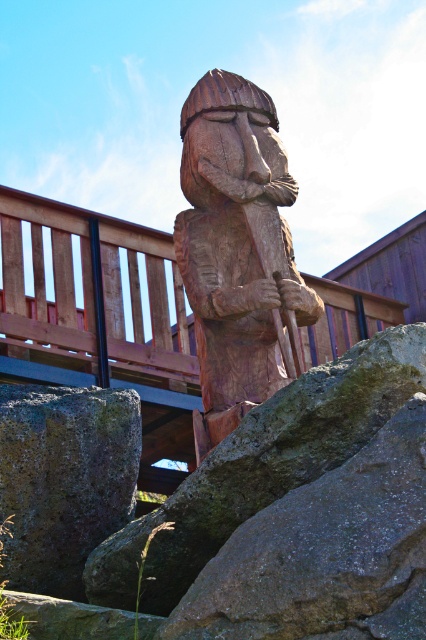
Question: Which point is farther from the camera taking this photo?

Choices:
 (A) (307, 385)
 (B) (14, 502)
 (C) (215, 208)

Answer: (C)

Question: Among these objects, which one is nearest to the camera?

Choices:
 (A) rough textured rock at center
 (B) gray rough stone at lower left

Answer: (A)

Question: Does rough textured rock at center appear under gray rough stone at lower left?

Choices:
 (A) yes
 (B) no

Answer: (B)

Question: Is the position of rough textured rock at center more distant than that of gray rough stone at lower left?

Choices:
 (A) no
 (B) yes

Answer: (A)

Question: From the image, what is the correct spatial relationship of rough textured rock at center in relation to gray rough stone at lower left?

Choices:
 (A) right
 (B) left

Answer: (A)

Question: Which point appears farthest from the camera in this image?

Choices:
 (A) (54, 456)
 (B) (207, 298)
 (C) (204, 538)

Answer: (B)